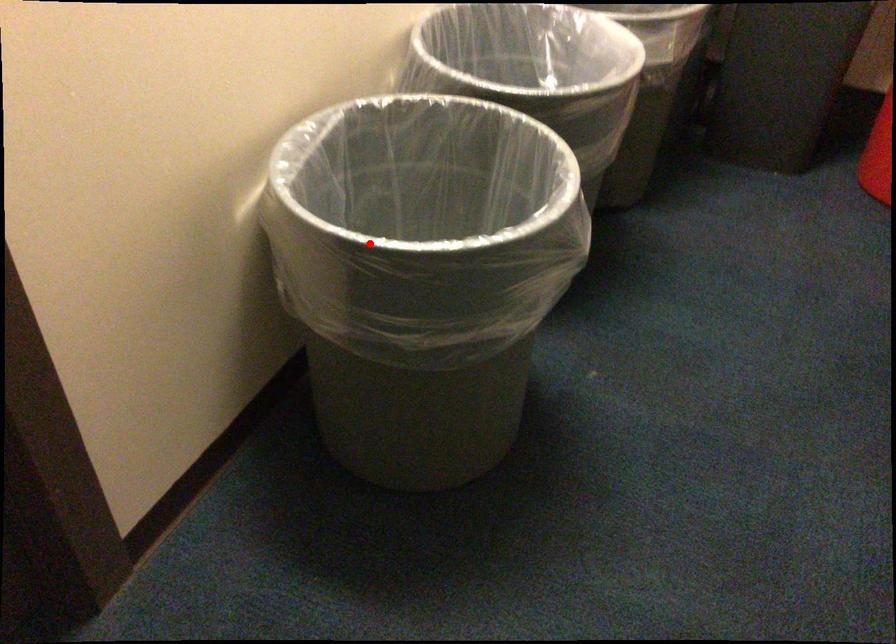
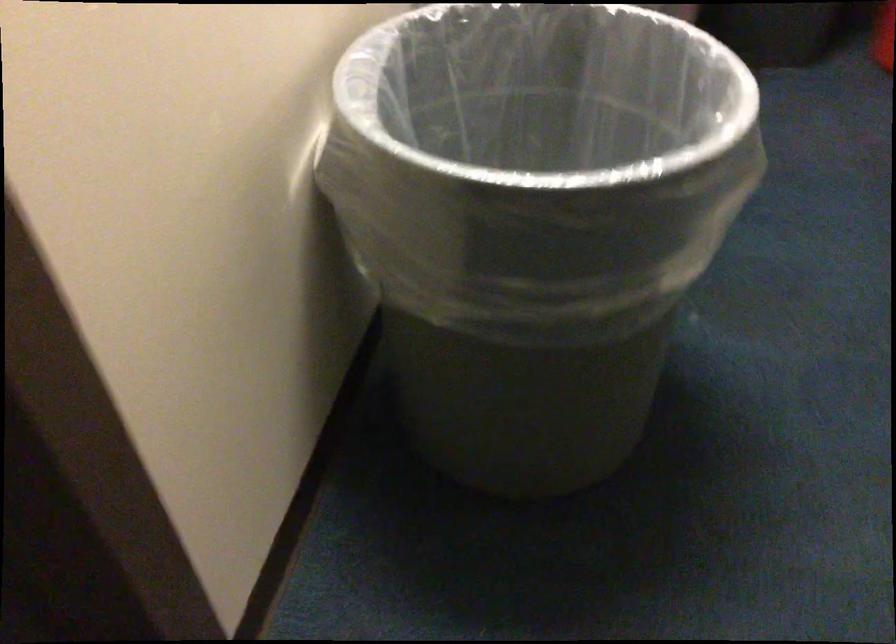
Question: I am providing you with two images of the same scene from different viewpoints. A red point is marked on the first image. Can you still see the location of the red point in image 2?

Choices:
 (A) Yes
 (B) No

Answer: (A)